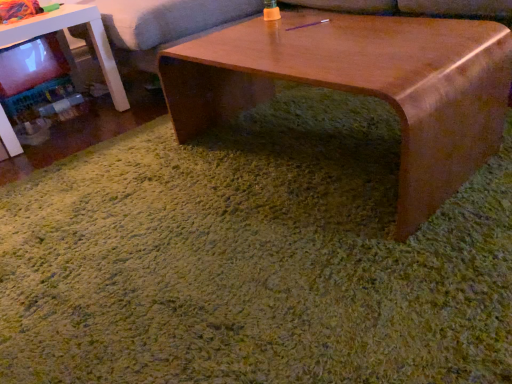
Question: Is wooden coffee table at center shorter than white glossy table at left?

Choices:
 (A) no
 (B) yes

Answer: (B)

Question: Is wooden coffee table at center smaller than white glossy table at left?

Choices:
 (A) no
 (B) yes

Answer: (A)

Question: Does wooden coffee table at center have a lesser width compared to white glossy table at left?

Choices:
 (A) yes
 (B) no

Answer: (A)

Question: From a real-world perspective, is wooden coffee table at center over white glossy table at left?

Choices:
 (A) yes
 (B) no

Answer: (B)

Question: Is wooden coffee table at center positioned behind white glossy table at left?

Choices:
 (A) no
 (B) yes

Answer: (A)

Question: From the image's perspective, does wooden coffee table at center appear higher than white glossy table at left?

Choices:
 (A) yes
 (B) no

Answer: (B)

Question: Could you tell me if wooden coffee table at center is turned towards soft gray couch at upper center?

Choices:
 (A) yes
 (B) no

Answer: (B)

Question: Is wooden coffee table at center in front of soft gray couch at upper center?

Choices:
 (A) no
 (B) yes

Answer: (B)

Question: From a real-world perspective, is wooden coffee table at center over soft gray couch at upper center?

Choices:
 (A) no
 (B) yes

Answer: (A)

Question: Can we say wooden coffee table at center lies outside soft gray couch at upper center?

Choices:
 (A) yes
 (B) no

Answer: (A)

Question: Can you confirm if wooden coffee table at center is thinner than soft gray couch at upper center?

Choices:
 (A) yes
 (B) no

Answer: (A)

Question: Can you confirm if wooden coffee table at center is smaller than soft gray couch at upper center?

Choices:
 (A) yes
 (B) no

Answer: (A)

Question: From a real-world perspective, is soft gray couch at upper center beneath white glossy table at left?

Choices:
 (A) yes
 (B) no

Answer: (B)